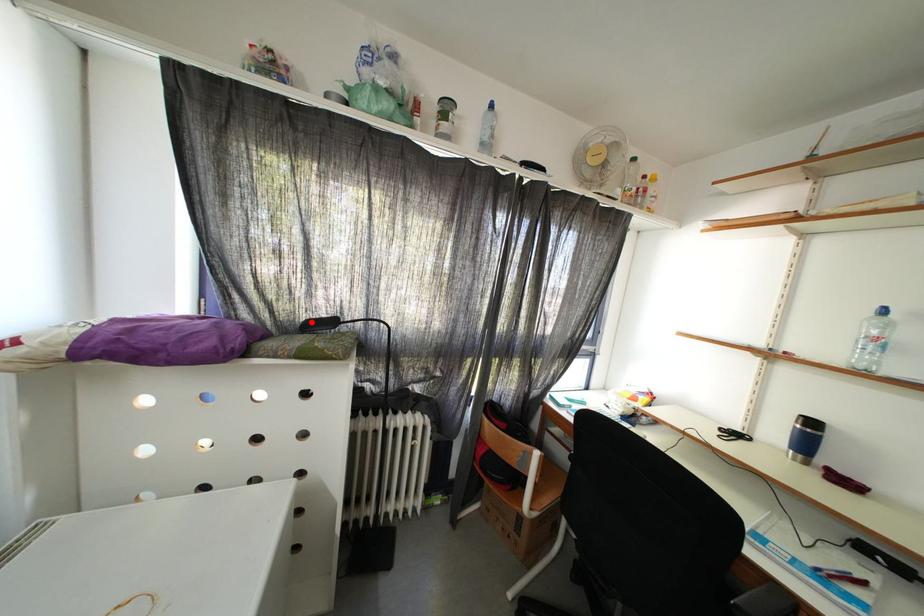
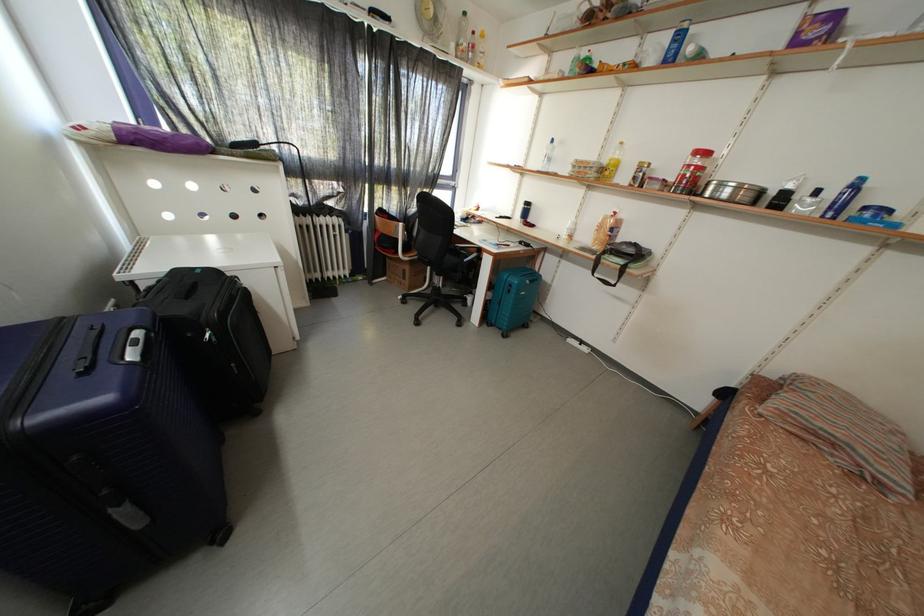
Find the pixel in the second image that matches the highlighted location in the first image.

(237, 145)